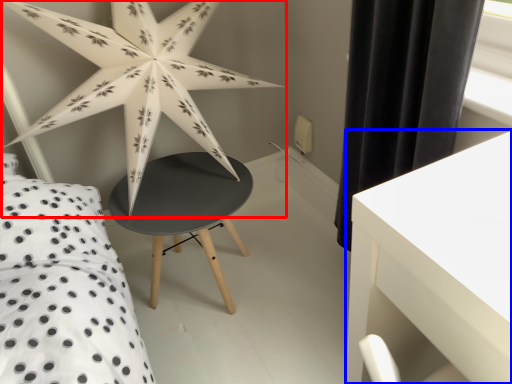
Question: Which of the following is the farthest to the observer, star (highlighted by a red box) or table (highlighted by a blue box)?

Choices:
 (A) star
 (B) table

Answer: (A)